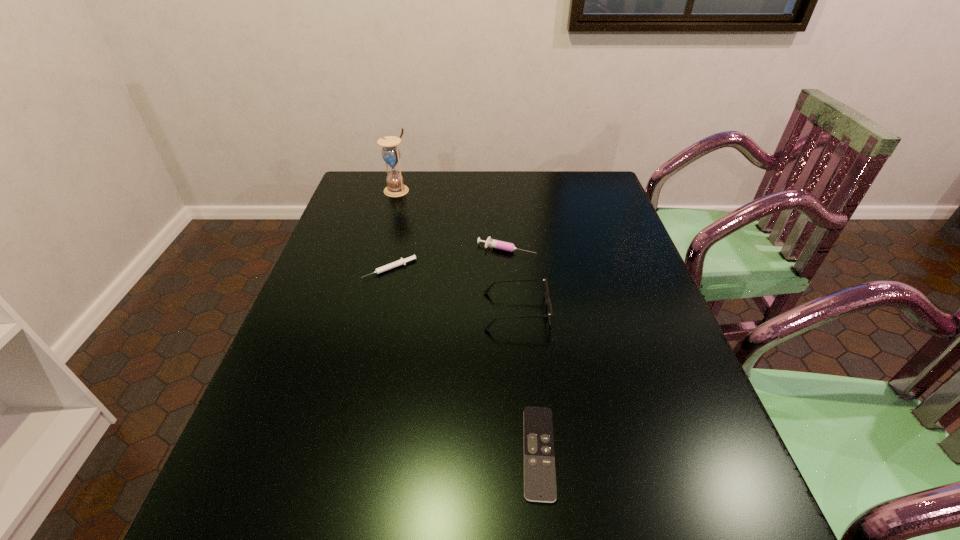
Where is `hourglass`? This screenshot has width=960, height=540. hourglass is located at coordinates (391, 154).

You are a GUI agent. You are given a task and a screenshot of the screen. Output one action in this format:
    pyautogui.click(x=<x>, y=<y>)
    Task: Click on the tallest object
    This screenshot has width=960, height=540.
    Given the screenshot: What is the action you would take?
    pyautogui.click(x=391, y=154)

Where is `the fourth shortest object`? The image size is (960, 540). the fourth shortest object is located at coordinates (548, 302).

I want to click on spectacles, so click(x=548, y=302).

The width and height of the screenshot is (960, 540). Identify the location of the farther syringe. coord(506,246).

Where is `the right syringe`? The width and height of the screenshot is (960, 540). the right syringe is located at coordinates (506, 246).

You are a GUI agent. You are given a task and a screenshot of the screen. Output one action in this format:
    pyautogui.click(x=<x>, y=<y>)
    Task: Click on the nearer syringe
    
    Given the screenshot: What is the action you would take?
    pyautogui.click(x=402, y=261)

The height and width of the screenshot is (540, 960). Identify the location of the third farthest object. (402, 261).

The width and height of the screenshot is (960, 540). What are the coordinates of `the shortest object` in the screenshot? It's located at pyautogui.click(x=539, y=459).

Locate an element on the screen. The width and height of the screenshot is (960, 540). remote control is located at coordinates 539,459.